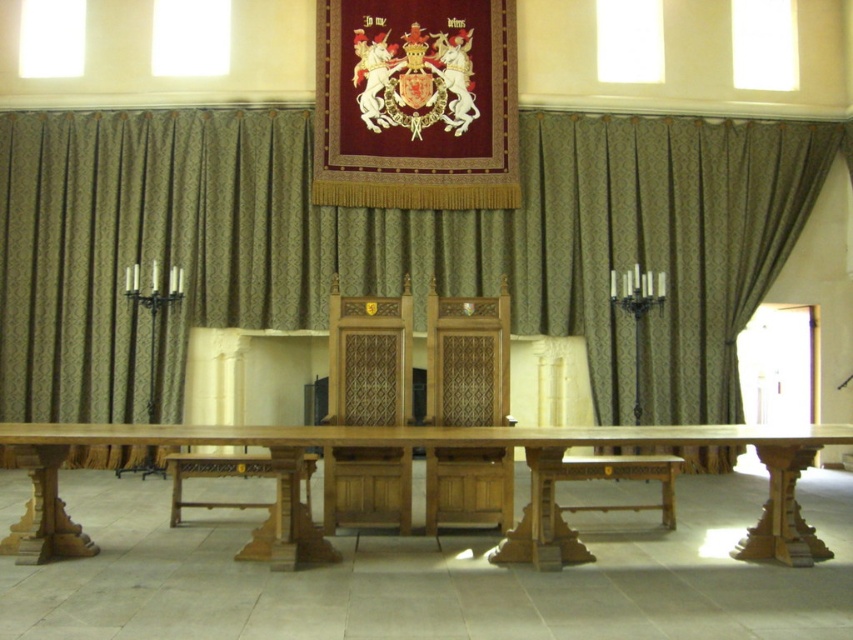
Question: Among these points, which one is nearest to the camera?

Choices:
 (A) (459, 502)
 (B) (372, 348)
 (C) (67, 541)

Answer: (C)

Question: Does polished wood chair at center have a greater width compared to wooden chair at center?

Choices:
 (A) yes
 (B) no

Answer: (A)

Question: Which of the following is the farthest from the observer?

Choices:
 (A) wooden chair at center
 (B) wooden table at center

Answer: (A)

Question: Can you confirm if wooden table at center is positioned above polished wood chair at center?

Choices:
 (A) no
 (B) yes

Answer: (A)

Question: Is wooden table at center to the left of polished wood chair at center from the viewer's perspective?

Choices:
 (A) no
 (B) yes

Answer: (A)

Question: Which point is closer to the camera?

Choices:
 (A) (363, 364)
 (B) (280, 481)
 (C) (503, 397)

Answer: (B)